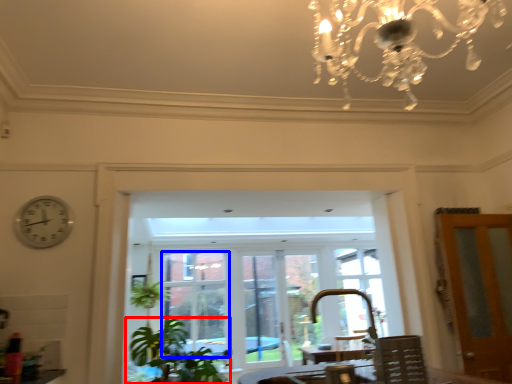
Question: Which of the following is the closest to the observer, houseplant (highlighted by a red box) or window (highlighted by a blue box)?

Choices:
 (A) houseplant
 (B) window

Answer: (A)